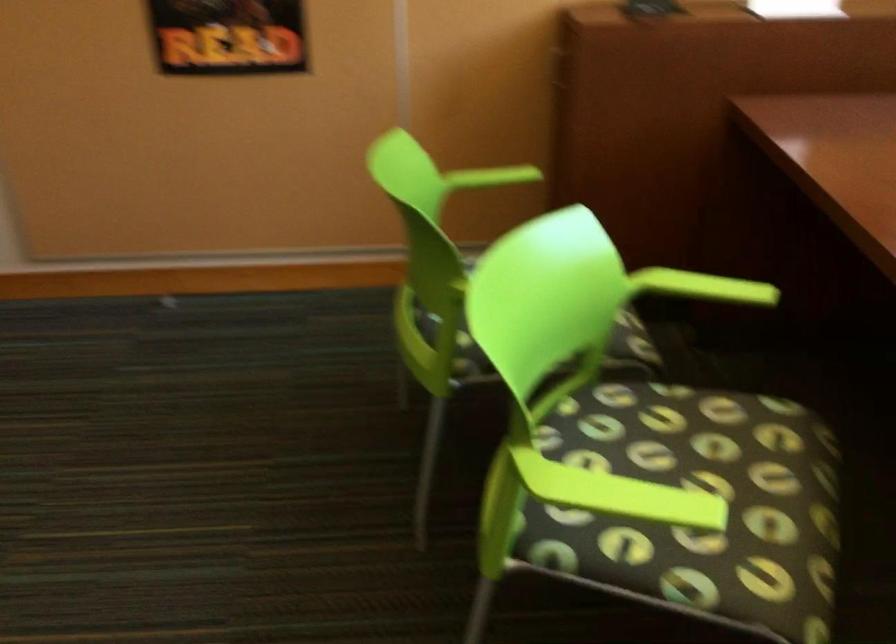
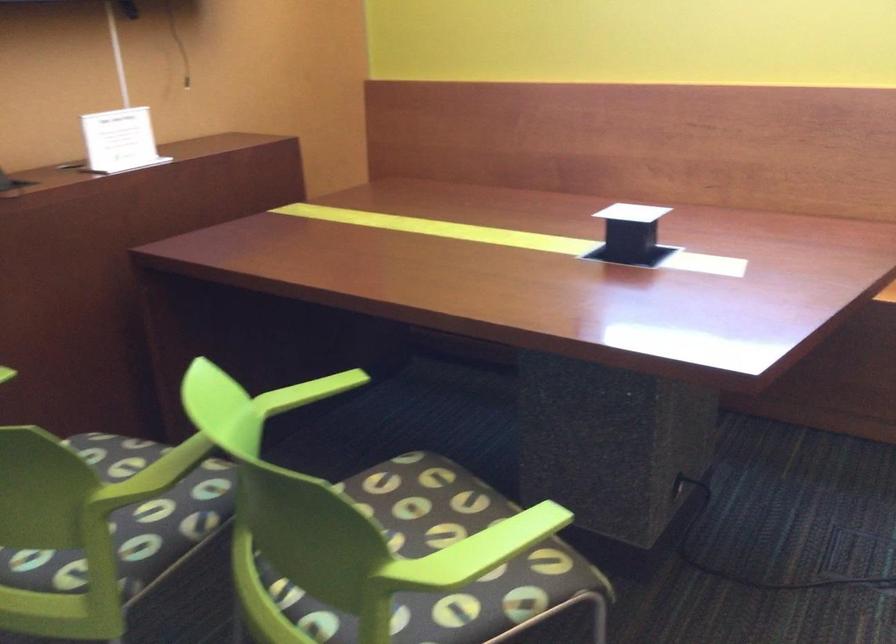
In the second image, find the point that corresponds to pixel 590 496 in the first image.

(476, 552)